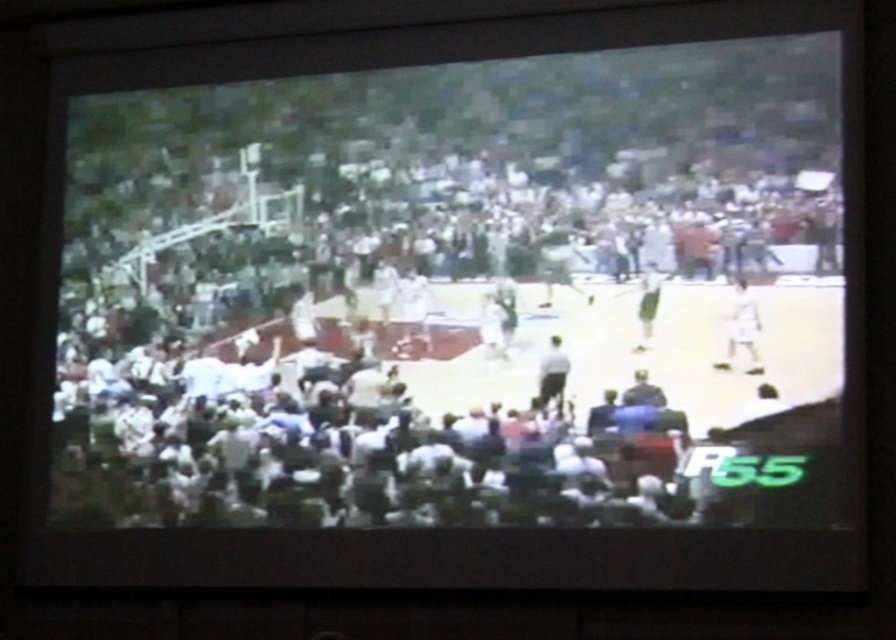
Can you confirm if white jersey basketball team at center is positioned to the right of light gray fabric person at center?

Incorrect, white jersey basketball team at center is not on the right side of light gray fabric person at center.

Can you confirm if white jersey basketball team at center is bigger than light gray fabric person at center?

Correct, white jersey basketball team at center is larger in size than light gray fabric person at center.

The width and height of the screenshot is (896, 640). I want to click on white jersey basketball team at center, so click(429, 333).

Identify the location of white jersey basketball team at center. (429, 333).

Which is more to the left, white matte basketball player at right or white fabric person at center?

white fabric person at center

Between white matte basketball player at right and white fabric person at center, which one has less height?

Standing shorter between the two is white fabric person at center.

Identify the location of white matte basketball player at right. (742, 328).

Which is in front, point (731, 332) or point (543, 388)?

Positioned in front is point (731, 332).

Who is higher up, white matte basketball player at right or light gray fabric person at center?

white matte basketball player at right

Is point (733, 301) less distant than point (547, 355)?

Yes.

Find the location of a particular element. This screenshot has width=896, height=640. white matte basketball player at right is located at coordinates (742, 328).